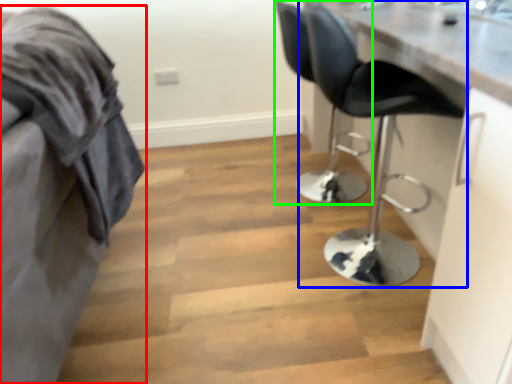
Question: Which is nearer to the furniture (highlighted by a red box)? chair (highlighted by a blue box) or chair (highlighted by a green box).

Choices:
 (A) chair
 (B) chair

Answer: (A)